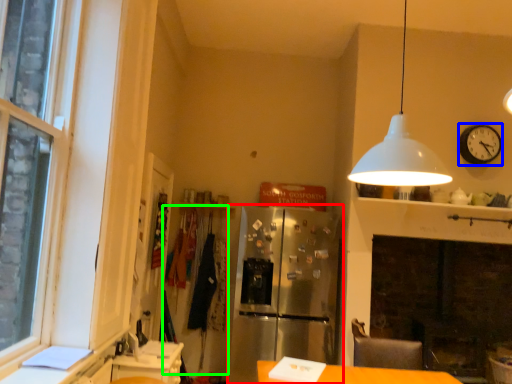
Question: Which object is positioned farthest from fridge (highlighted by a red box)? Select from clock (highlighted by a blue box) and laundry (highlighted by a green box).

Choices:
 (A) clock
 (B) laundry

Answer: (A)